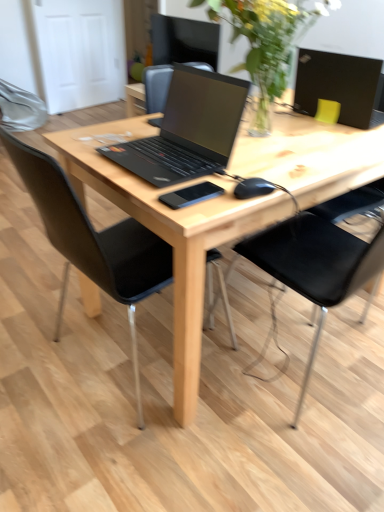
Locate an element on the screen. vacant space underneath black leather chair at center, which is counted as the 1th chair, starting from the right (from a real-world perspective) is located at coordinates (336, 365).